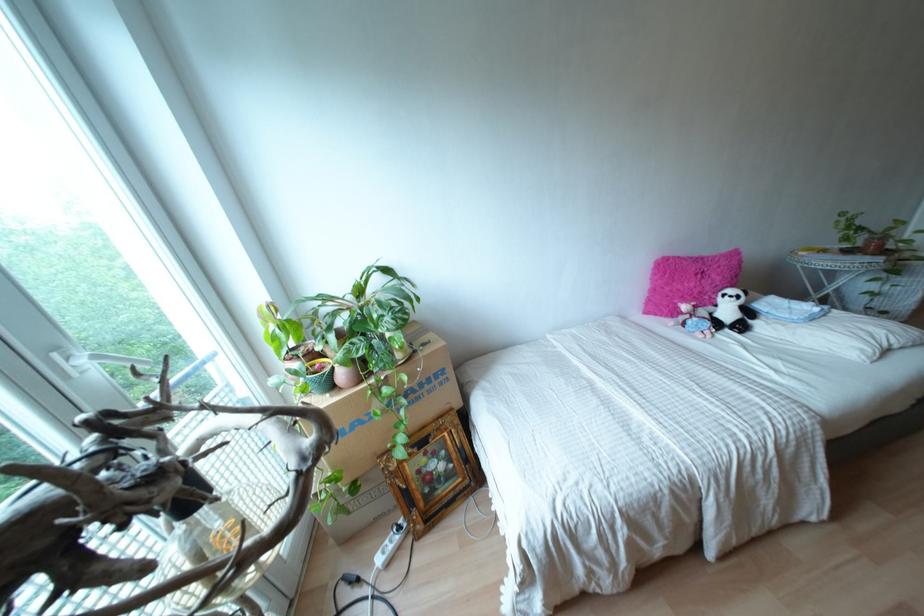
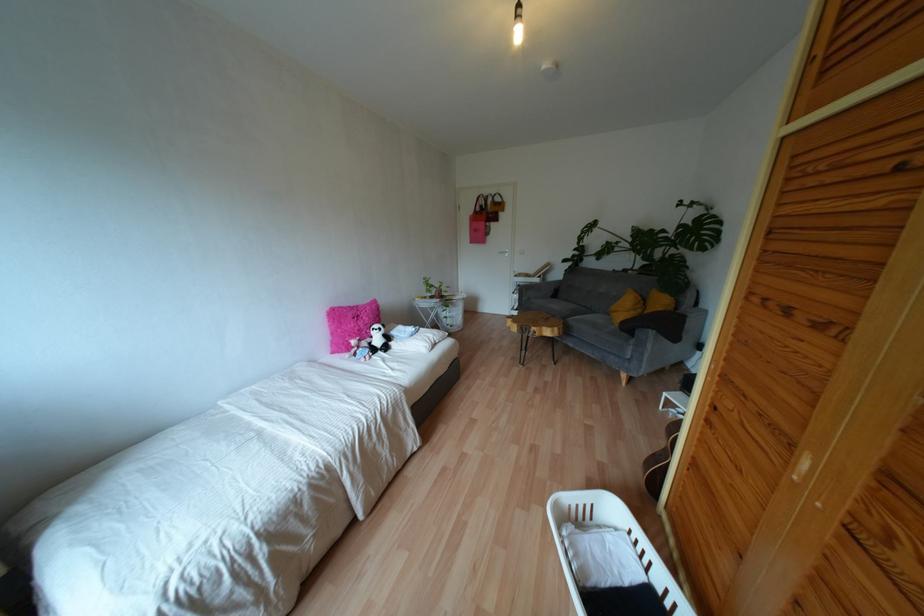
Locate, in the second image, the point that corresponds to (666,288) in the first image.

(338, 330)